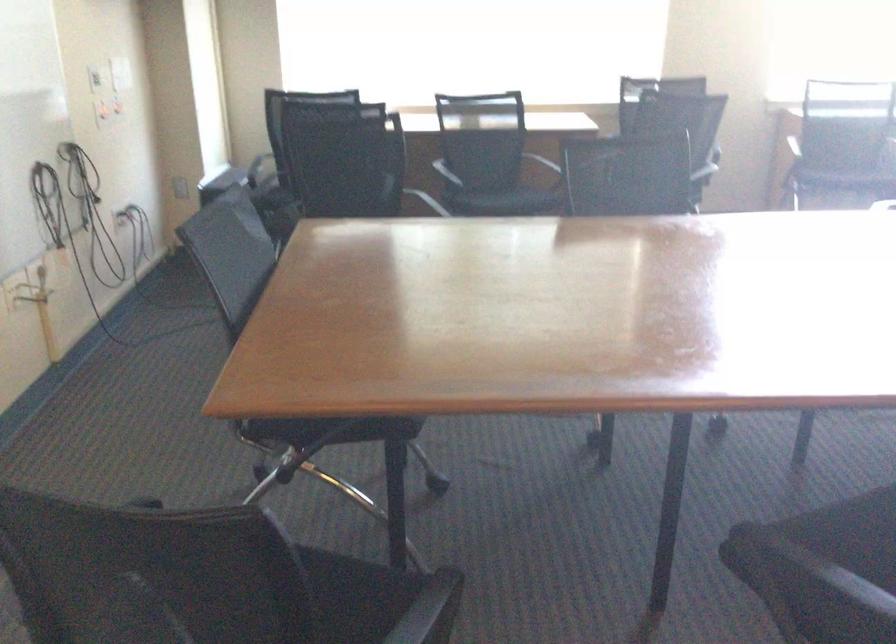
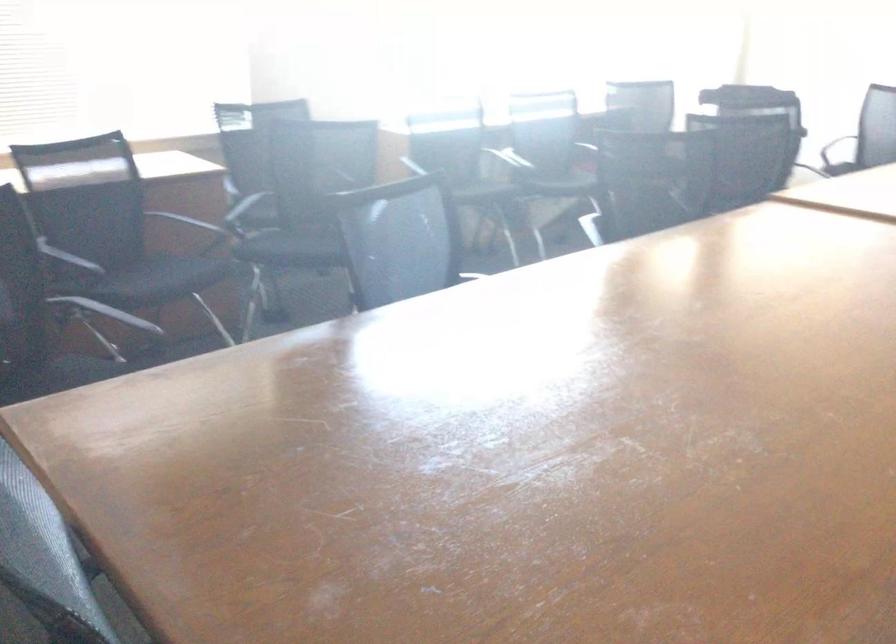
The point at [506,198] is marked in the first image. Where is the corresponding point in the second image?

(159, 279)